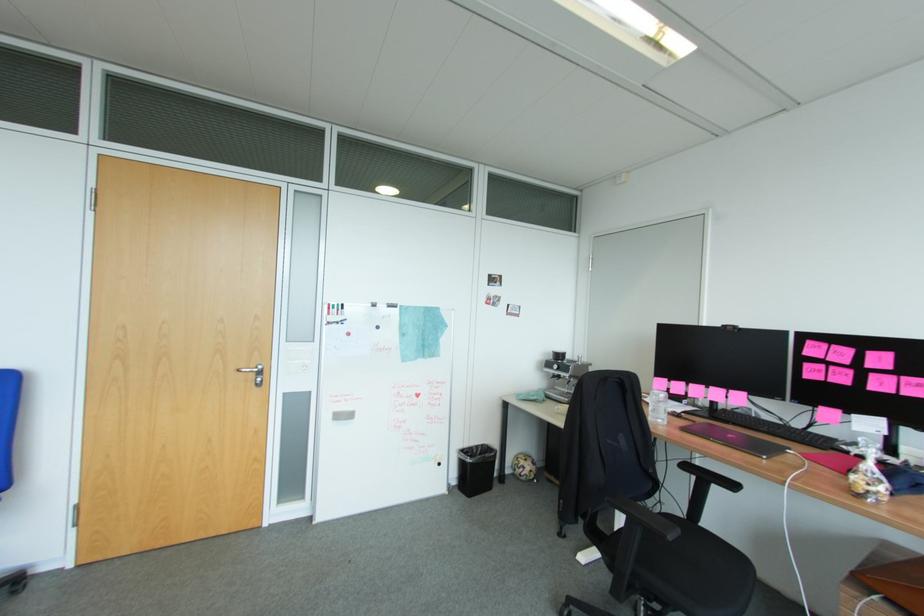
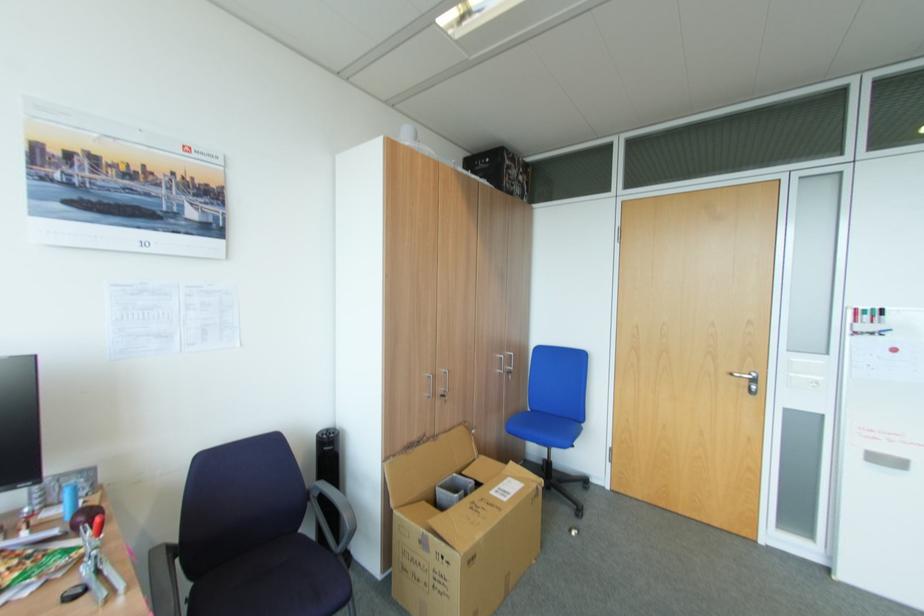
Locate, in the second image, the point that corresponds to the point at 330,322 in the first image.

(856, 333)